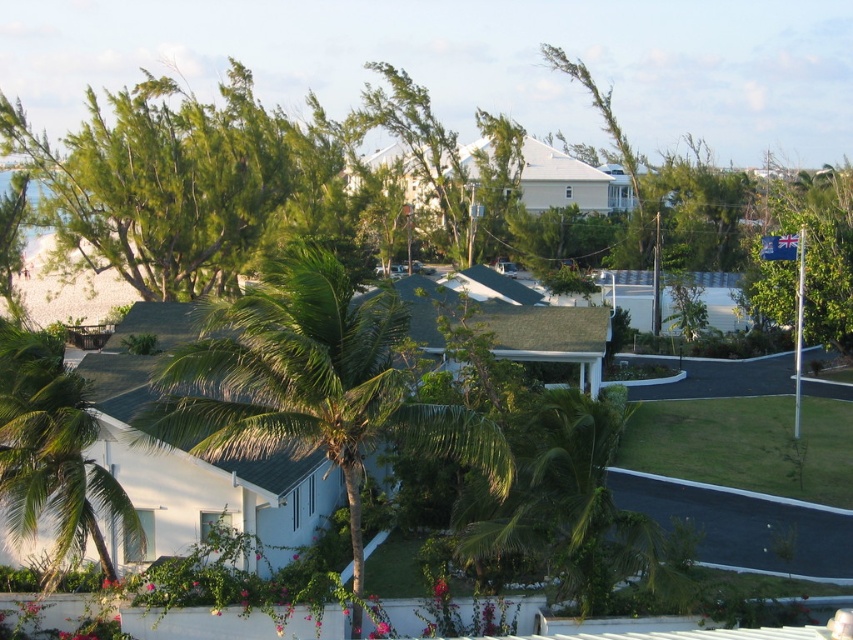
Can you confirm if green leafy palm tree at center is bigger than green leafy palm tree at lower left?

Yes.

Does green leafy palm tree at center have a greater height compared to green leafy palm tree at lower left?

Yes, green leafy palm tree at center is taller than green leafy palm tree at lower left.

Is point (206, 365) positioned after point (56, 433)?

That is False.

In order to click on green leafy palm tree at center in this screenshot , I will do `click(309, 384)`.